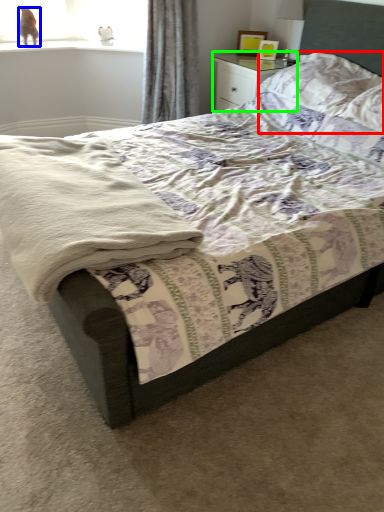
Question: Based on their relative distances, which object is nearer to pillow (highlighted by a red box)? Choose from animal (highlighted by a blue box) and nightstand (highlighted by a green box).

Choices:
 (A) animal
 (B) nightstand

Answer: (B)